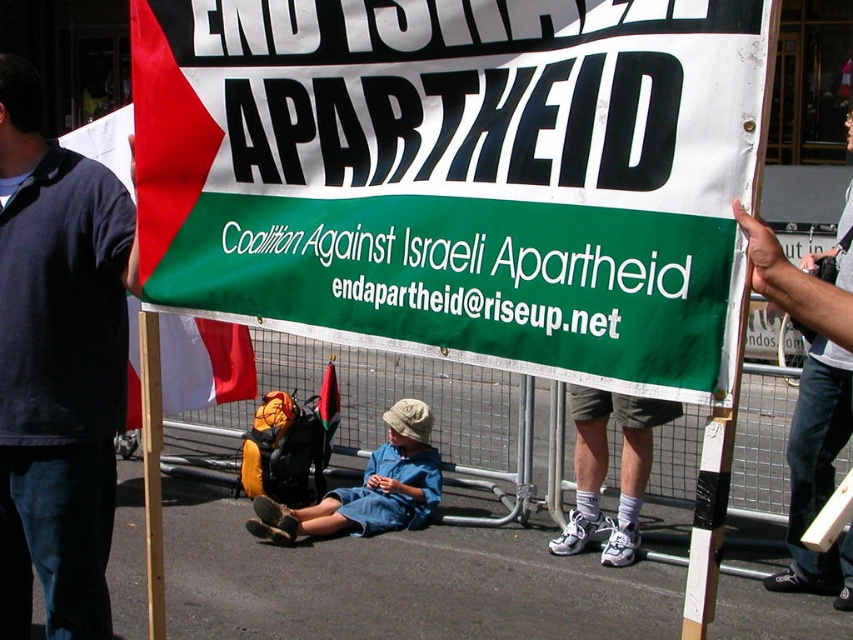
Question: Which object is the closest to the red fabric flag at upper left?

Choices:
 (A) white paper banner at center
 (B) dark blue polo shirt at left
 (C) blue denim shorts at center
 (D) green fabric flag at center

Answer: (D)

Question: Where is blue denim shorts at center located in relation to green fabric flag at center in the image?

Choices:
 (A) right
 (B) left

Answer: (A)

Question: Which point is closer to the camera?

Choices:
 (A) (230, 330)
 (B) (381, 448)

Answer: (B)

Question: Considering the real-world distances, which object is farthest from the red fabric flag at upper left?

Choices:
 (A) white paper banner at center
 (B) blue denim shorts at center

Answer: (A)

Question: Does white paper banner at center appear on the right side of green fabric flag at center?

Choices:
 (A) no
 (B) yes

Answer: (B)

Question: Can you confirm if white paper banner at center is positioned above green fabric flag at center?

Choices:
 (A) yes
 (B) no

Answer: (A)